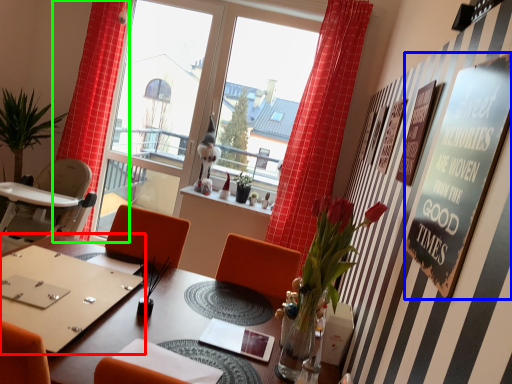
Question: Which object is the closest to the round table (highlighted by a red box)? Choose among these: bulletin board (highlighted by a blue box) or curtain (highlighted by a green box).

Choices:
 (A) bulletin board
 (B) curtain

Answer: (A)